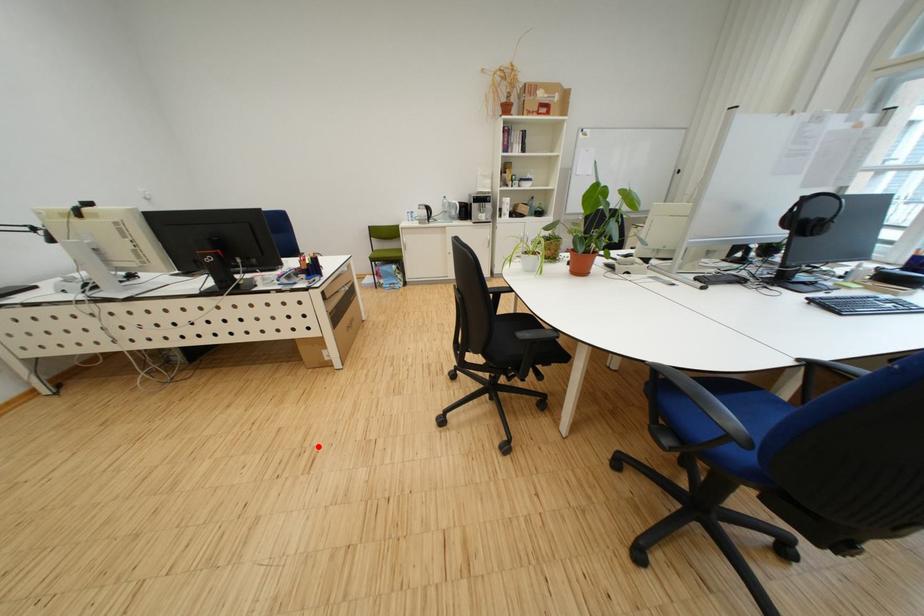
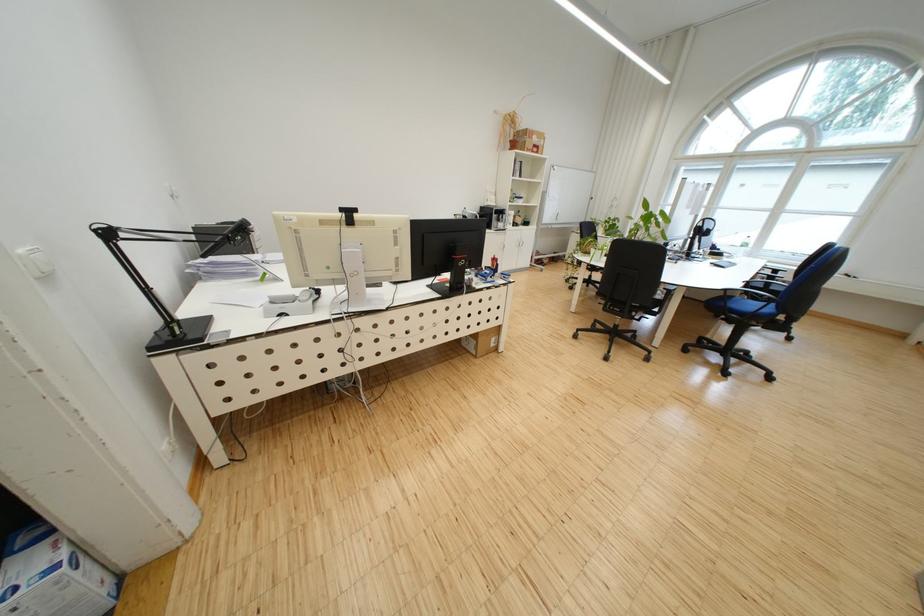
Where in the second image is the point corresponding to the highlighted location from the first image?

(572, 395)